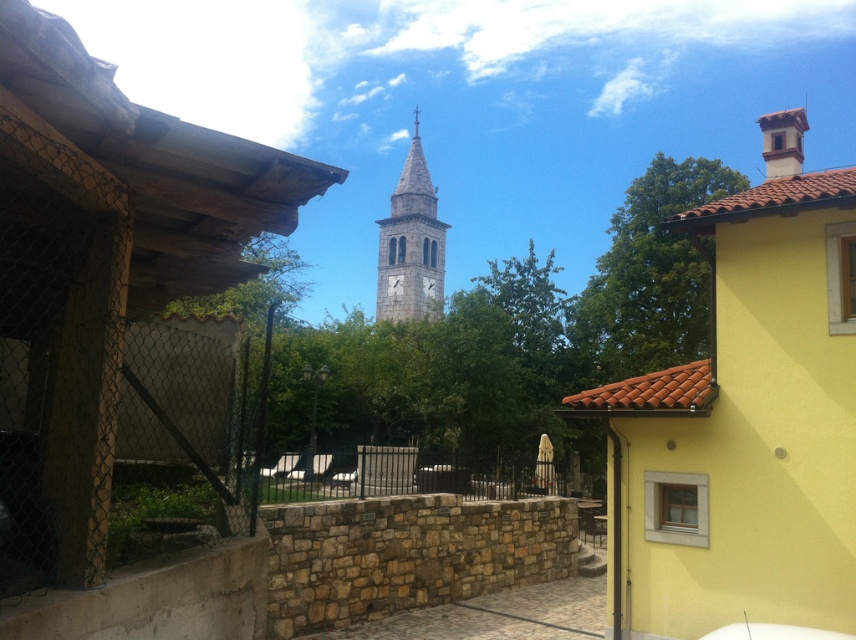
You are an architect analyzing the spatial relationship between the yellow matte building at upper right and the gray stone clock tower at center. Which structure has a greater height?

The gray stone clock tower at center has a greater height compared to the yellow matte building at upper right.

You are standing in the outdoor scene and want to know how far the point at coordinates (776, 420) is from you. Can you determine the distance?

The point at coordinates (776, 420) is 15.11 meters away from the viewer.

You are standing in the outdoor scene and want to place a small decoration between the two points, point (688, 602) and point (491, 493). Which point should the decoration be closer to in order to appear larger in the image?

The decoration should be placed closer to point (688, 602) because it is closer to the viewer, making objects placed there appear larger in the image.